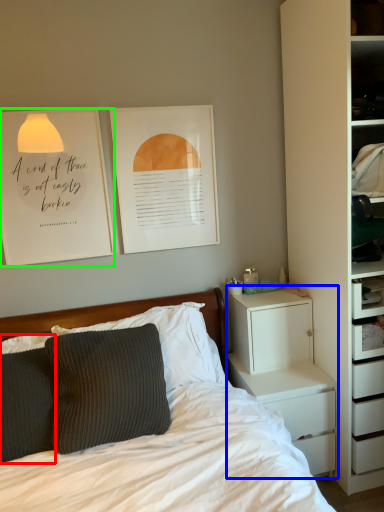
Question: Which is nearer to the pillow (highlighted by a red box)? chest of drawers (highlighted by a blue box) or bulletin board (highlighted by a green box).

Choices:
 (A) chest of drawers
 (B) bulletin board

Answer: (B)